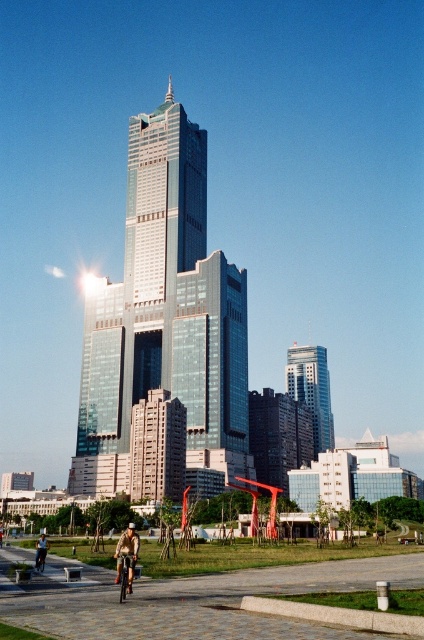
Is shiny glass skyscraper at center below silver metallic skyscraper at center?

No, shiny glass skyscraper at center is not below silver metallic skyscraper at center.

Can you confirm if shiny glass skyscraper at center is positioned to the right of silver metallic skyscraper at center?

In fact, shiny glass skyscraper at center is to the left of silver metallic skyscraper at center.

Who is more distant from viewer, (x=81, y=374) or (x=306, y=394)?

The point (x=306, y=394) is behind.

Locate an element on the screen. The image size is (424, 640). shiny glass skyscraper at center is located at coordinates (164, 330).

Between shiny glass skyscraper at center and silver metallic bicycle at center, which one has more height?

shiny glass skyscraper at center is taller.

Who is positioned more to the right, shiny glass skyscraper at center or silver metallic bicycle at center?

From the viewer's perspective, silver metallic bicycle at center appears more on the right side.

Does point (147, 490) come closer to viewer compared to point (123, 554)?

No, it is behind (123, 554).

Image resolution: width=424 pixels, height=640 pixels. Identify the location of shiny glass skyscraper at center. (164, 330).

Is silver metallic bicycle at center closer to the viewer compared to light brown leather jacket at lower center?

Yes, silver metallic bicycle at center is closer to the viewer.

Can you confirm if silver metallic bicycle at center is taller than light brown leather jacket at lower center?

No, silver metallic bicycle at center is not taller than light brown leather jacket at lower center.

Measure the distance between silver metallic bicycle at center and camera.

silver metallic bicycle at center and camera are 31.55 meters apart from each other.

At what (x,y) coordinates should I click in order to perform the action: click on silver metallic bicycle at center. Please return your answer as a coordinate pair (x, y). This screenshot has width=424, height=640. Looking at the image, I should click on (125, 573).